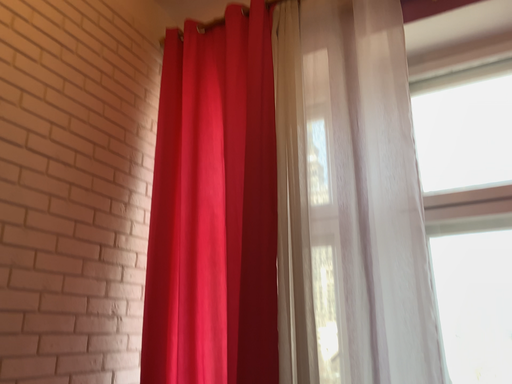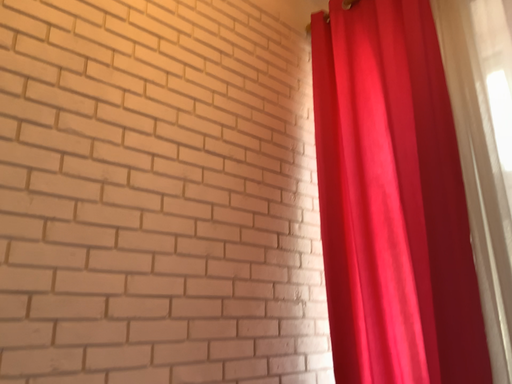
Question: How did the camera likely rotate when shooting the video?

Choices:
 (A) rotated right
 (B) rotated left

Answer: (B)